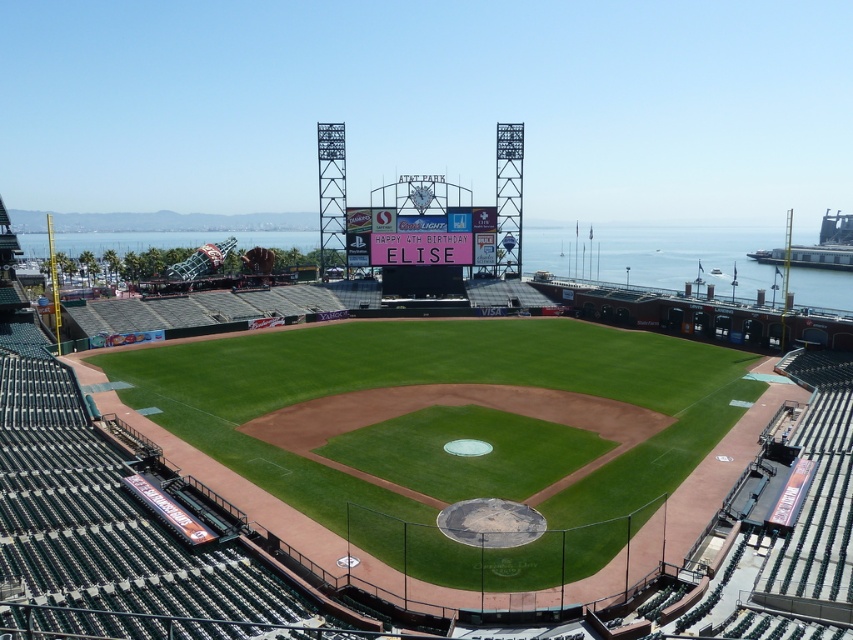
Question: Which object is farther from the camera taking this photo?

Choices:
 (A) green grass baseball stadium at center
 (B) transparent glass water at center

Answer: (B)

Question: Can you confirm if green grass baseball stadium at center is thinner than transparent glass water at center?

Choices:
 (A) no
 (B) yes

Answer: (B)

Question: Is green grass baseball stadium at center further to camera compared to pink fabric sign at center?

Choices:
 (A) no
 (B) yes

Answer: (A)

Question: Which object is farther from the camera taking this photo?

Choices:
 (A) green grass baseball stadium at center
 (B) pink fabric sign at center
 (C) transparent glass water at center

Answer: (B)

Question: Based on their relative distances, which object is nearer to the green grass baseball stadium at center?

Choices:
 (A) pink fabric sign at center
 (B) transparent glass water at center

Answer: (A)

Question: Can you confirm if transparent glass water at center is positioned above pink fabric sign at center?

Choices:
 (A) no
 (B) yes

Answer: (B)